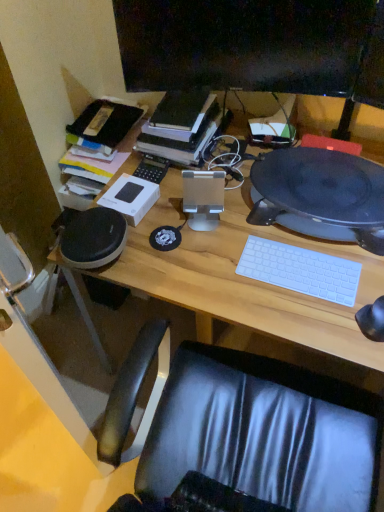
Where is `free space in front of white matte keyboard at center`? The image size is (384, 512). free space in front of white matte keyboard at center is located at coordinates (310, 319).